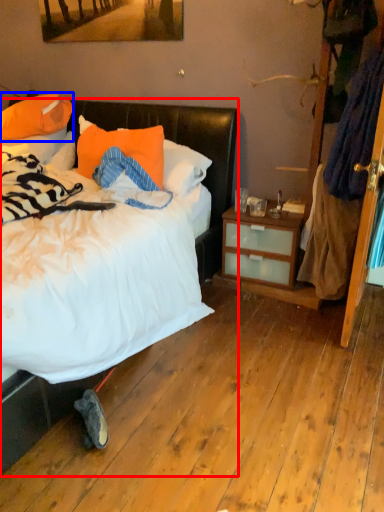
Question: Which object appears farthest to the camera in this image, bed (highlighted by a red box) or pillow (highlighted by a blue box)?

Choices:
 (A) bed
 (B) pillow

Answer: (B)